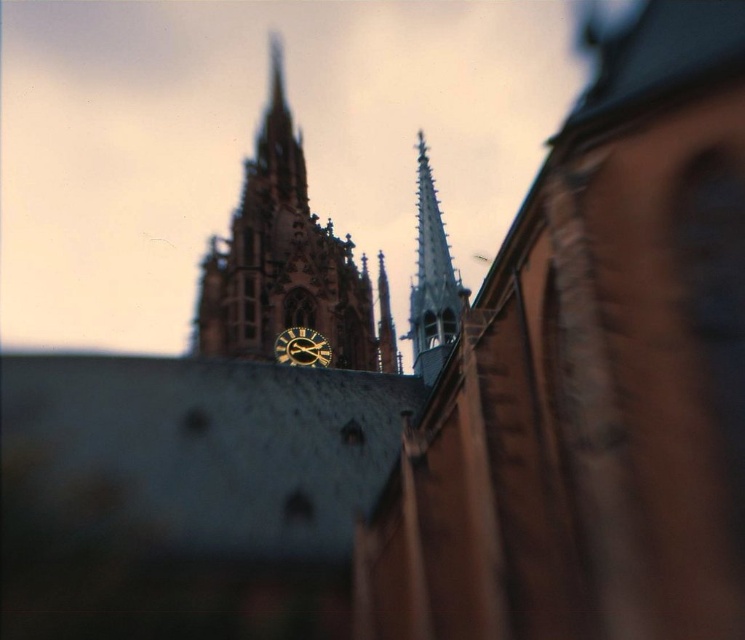
Is point (389, 340) positioned after point (285, 355)?

Yes, point (389, 340) is farther from viewer.

Can you confirm if golden stone clock tower at center is positioned to the right of gold metallic clock at center?

No, golden stone clock tower at center is not to the right of gold metallic clock at center.

Where is `golden stone clock tower at center`? golden stone clock tower at center is located at coordinates (285, 262).

Does point (381, 356) come farther from viewer compared to point (415, 289)?

Yes.

Can you confirm if golden stone clock tower at center is bigger than smooth gray spire at center?

Indeed, golden stone clock tower at center has a larger size compared to smooth gray spire at center.

Does point (294, 195) lie in front of point (451, 269)?

No, it is behind (451, 269).

This screenshot has width=745, height=640. What are the coordinates of `golden stone clock tower at center` in the screenshot? It's located at (285, 262).

Consider the image. Who is more distant from viewer, (463, 289) or (297, 344)?

Positioned behind is point (297, 344).

Between smooth gray spire at center and gold metallic clock at center, which one is positioned lower?

gold metallic clock at center is below.

Consider the image. Who is more distant from viewer, (456, 312) or (273, 355)?

Point (273, 355)

You are a GUI agent. You are given a task and a screenshot of the screen. Output one action in this format:
    pyautogui.click(x=<x>, y=<y>)
    Task: Click on the smooth gray spire at center
    The image size is (745, 640).
    Given the screenshot: What is the action you would take?
    pyautogui.click(x=431, y=280)